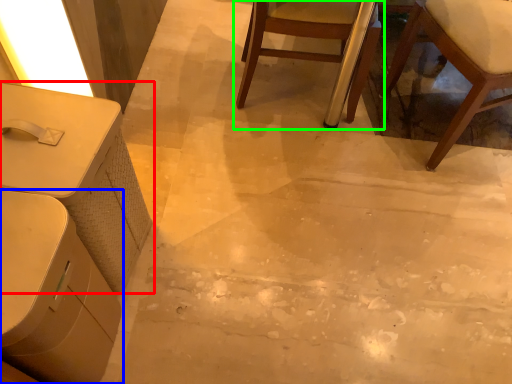
Question: Which object is positioned closest to table (highlighted by a red box)? Select from table (highlighted by a blue box) and chair (highlighted by a green box).

Choices:
 (A) table
 (B) chair

Answer: (A)